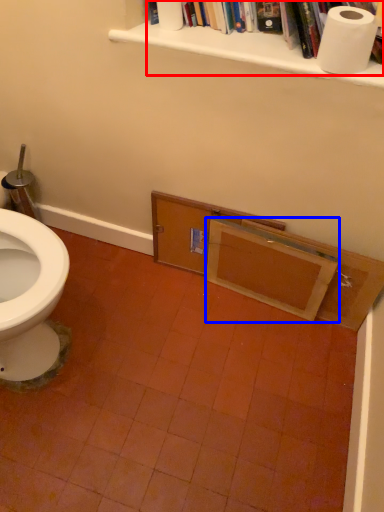
Question: Among these objects, which one is farthest to the camera, book (highlighted by a red box) or drawer (highlighted by a blue box)?

Choices:
 (A) book
 (B) drawer

Answer: (B)